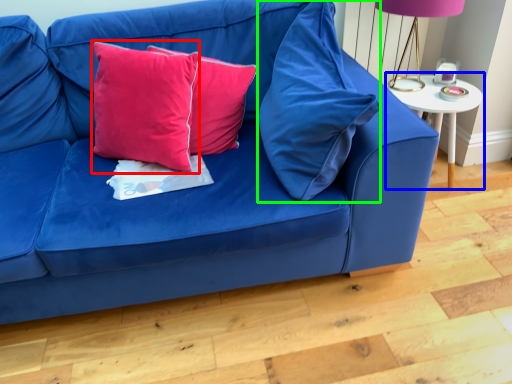
Question: Considering the real-world distances, which object is farthest from pillow (highlighted by a red box)? table (highlighted by a blue box) or pillow (highlighted by a green box)?

Choices:
 (A) table
 (B) pillow

Answer: (A)